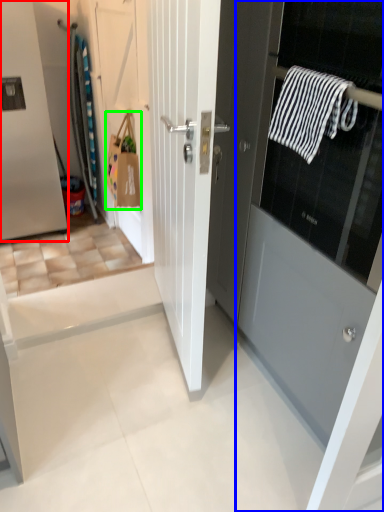
Question: Based on their relative distances, which object is farther from door (highlighted by a red box)? Choose from door (highlighted by a blue box) and shopping bag (highlighted by a green box).

Choices:
 (A) door
 (B) shopping bag

Answer: (A)